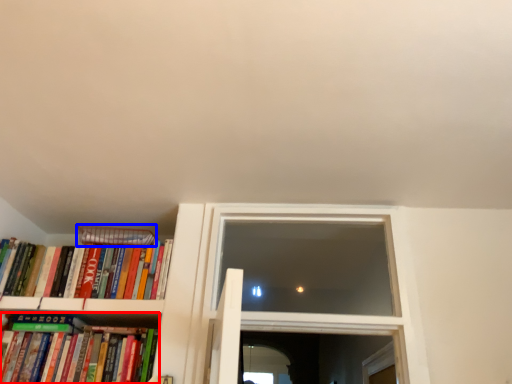
Question: Which of the following is the farthest to the observer, book (highlighted by a red box) or paperback book (highlighted by a blue box)?

Choices:
 (A) book
 (B) paperback book

Answer: (B)